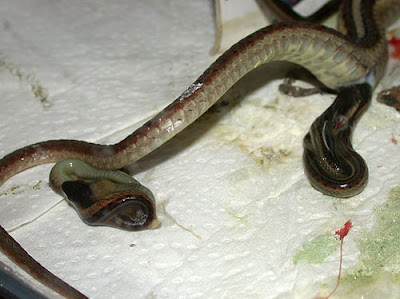
The height and width of the screenshot is (299, 400). In order to click on edge of absorbable mat in this screenshot , I will do `click(5, 270)`.